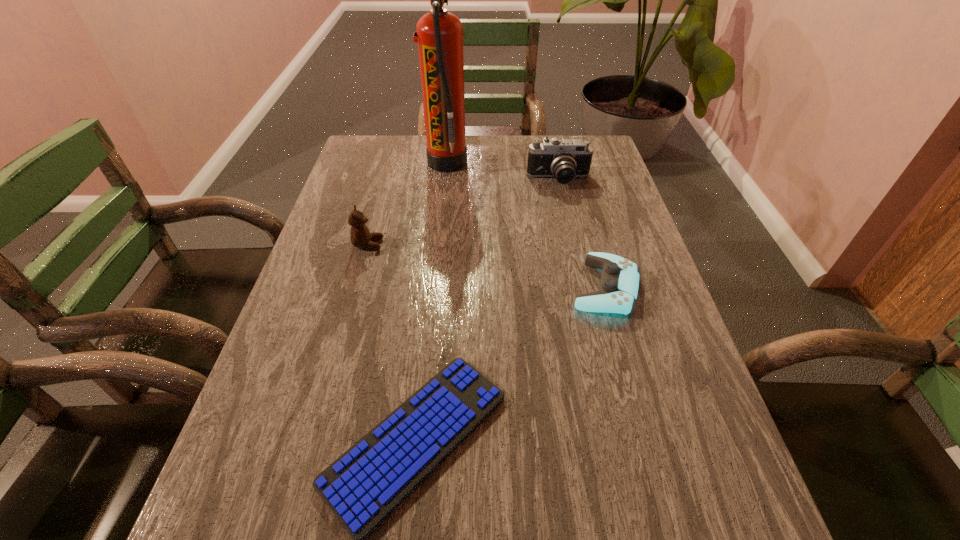
Where is `camera at the far edge`? This screenshot has height=540, width=960. camera at the far edge is located at coordinates (564, 159).

Image resolution: width=960 pixels, height=540 pixels. I want to click on object that is at the left edge, so click(x=360, y=235).

Find the location of a particular element. The width and height of the screenshot is (960, 540). camera that is at the right edge is located at coordinates (564, 159).

Find the location of a particular element. Image resolution: width=960 pixels, height=540 pixels. control positioned at the right edge is located at coordinates pyautogui.click(x=618, y=288).

Locate an element on the screen. The width and height of the screenshot is (960, 540). object located at the far right corner is located at coordinates (564, 159).

The width and height of the screenshot is (960, 540). I want to click on free region at the far edge of the desktop, so click(x=468, y=160).

The image size is (960, 540). I want to click on free space at the left edge, so click(329, 215).

In the image, there is a desktop. Where is `vacant space at the right edge`? The image size is (960, 540). vacant space at the right edge is located at coordinates (600, 219).

Identify the location of vacant region at the far right corner of the desktop. (605, 150).

At what (x,y) coordinates should I click in order to perform the action: click on free space between the fourth farthest object and the tallest object. Please return your answer as a coordinate pair (x, y). Looking at the image, I should click on (526, 225).